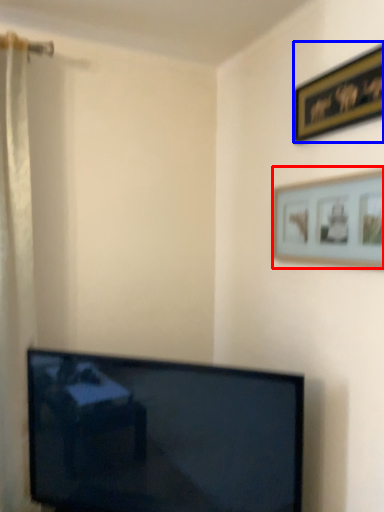
Question: Which object is further to the camera taking this photo, picture frame (highlighted by a red box) or picture frame (highlighted by a blue box)?

Choices:
 (A) picture frame
 (B) picture frame

Answer: (B)